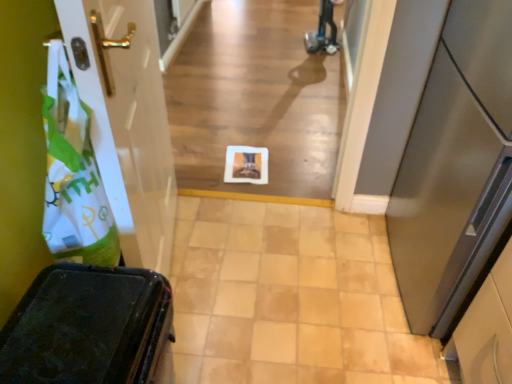
Find the location of `blank space situated above matte black suitcase at lower left (from a real-world perspective)`. blank space situated above matte black suitcase at lower left (from a real-world perspective) is located at coordinates (71, 326).